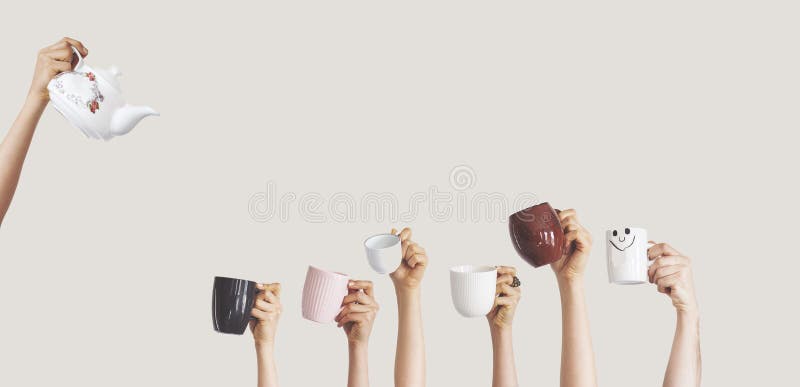
You are a GUI agent. You are given a task and a screenshot of the screen. Output one action in this format:
    pyautogui.click(x=<x>, y=<y>)
    Task: Click on the mugs
    This screenshot has height=387, width=800.
    Given the screenshot: What is the action you would take?
    pyautogui.click(x=226, y=302), pyautogui.click(x=330, y=291), pyautogui.click(x=389, y=250), pyautogui.click(x=472, y=295), pyautogui.click(x=529, y=248), pyautogui.click(x=634, y=259)